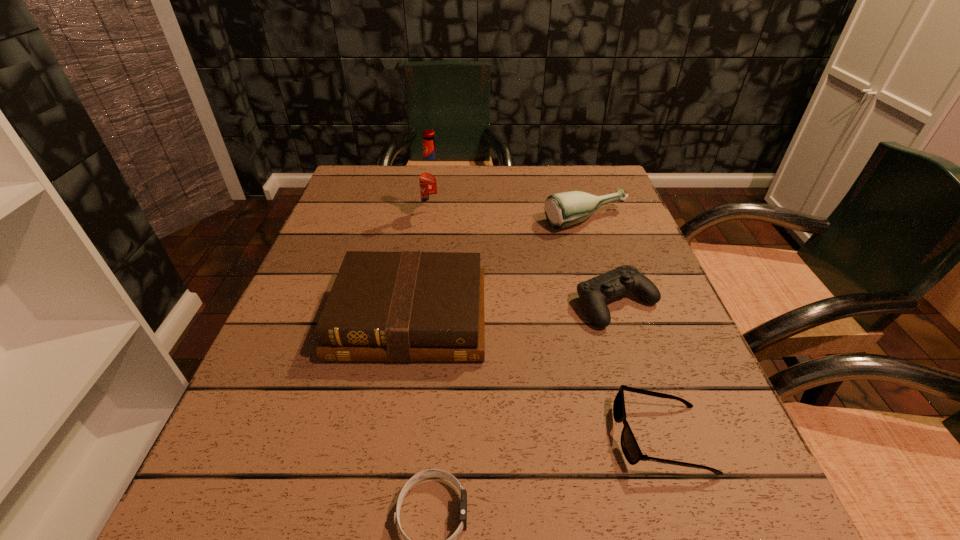
Find the location of `vacant space located on the front-facing side of the sunglasses`. vacant space located on the front-facing side of the sunglasses is located at coordinates (419, 437).

Find the location of a particular element. vacant area situated 0.090m on the front-facing side of the sunglasses is located at coordinates (558, 437).

The image size is (960, 540). Find the location of `root beer that is positioned at the far edge`. root beer that is positioned at the far edge is located at coordinates (431, 175).

Locate an element on the screen. The width and height of the screenshot is (960, 540). bottle that is positioned at the far edge is located at coordinates (564, 209).

This screenshot has width=960, height=540. What are the coordinates of `object present at the left edge` in the screenshot? It's located at (411, 306).

Find the location of a particular element. bottle situated at the right edge is located at coordinates (564, 209).

Where is `control that is at the right edge`? Image resolution: width=960 pixels, height=540 pixels. control that is at the right edge is located at coordinates (594, 293).

Identify the location of sunglasses at the right edge. (631, 450).

Locate an element on the screen. object that is at the far right corner is located at coordinates click(x=564, y=209).

Find the location of a particular element. The height and width of the screenshot is (540, 960). vacant space at the near edge of the desktop is located at coordinates (630, 537).